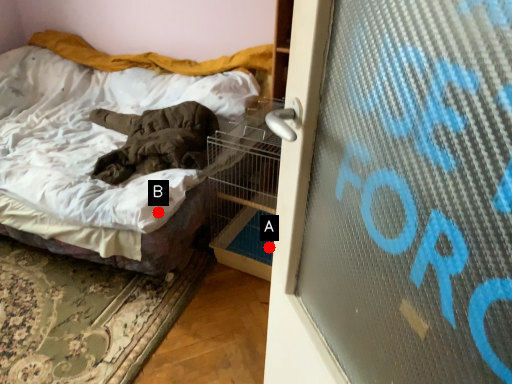
Question: Two points are circled on the image, labeled by A and B beside each circle. Among these points, which one is farthest from the camera?

Choices:
 (A) A is further
 (B) B is further

Answer: (A)